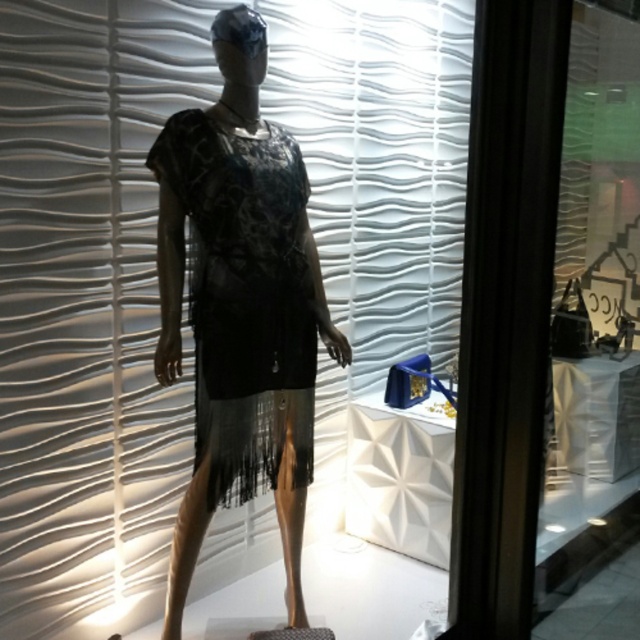
Is white matte blind at upper center taller than black mesh dress at center?

Correct, white matte blind at upper center is much taller as black mesh dress at center.

Who is lower down, white matte blind at upper center or black mesh dress at center?

Positioned lower is black mesh dress at center.

Identify the location of white matte blind at upper center. (186, 284).

Which is more to the right, white matte blind at upper center or black lace dress at center?

white matte blind at upper center is more to the right.

Is white matte blind at upper center thinner than black lace dress at center?

In fact, white matte blind at upper center might be wider than black lace dress at center.

Is point (388, 243) less distant than point (230, 284)?

No, (388, 243) is behind (230, 284).

Where is `white matte blind at upper center`? white matte blind at upper center is located at coordinates (186, 284).

Is point (236, 61) in front of point (275, 140)?

Yes, point (236, 61) is closer to viewer.

Between black lace dress at center and black mesh dress at center, which one has less height?

black mesh dress at center

The height and width of the screenshot is (640, 640). Describe the element at coordinates (241, 307) in the screenshot. I see `black lace dress at center` at that location.

Locate an element on the screen. black lace dress at center is located at coordinates (241, 307).